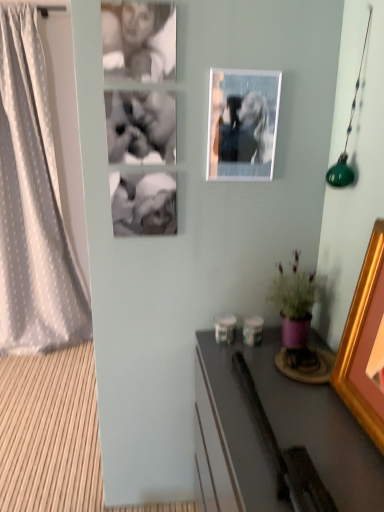
The image size is (384, 512). Find the location of `empty space that is ontop of smooth gray desk at lower right (from a real-world perspective)`. empty space that is ontop of smooth gray desk at lower right (from a real-world perspective) is located at coordinates (283, 399).